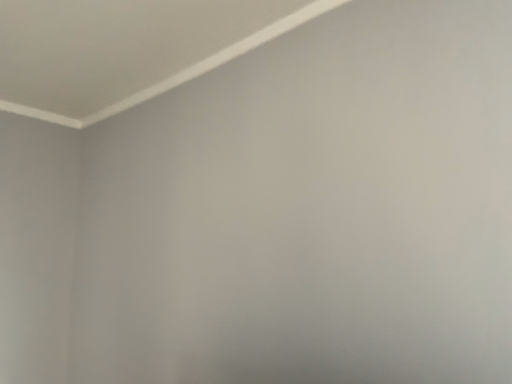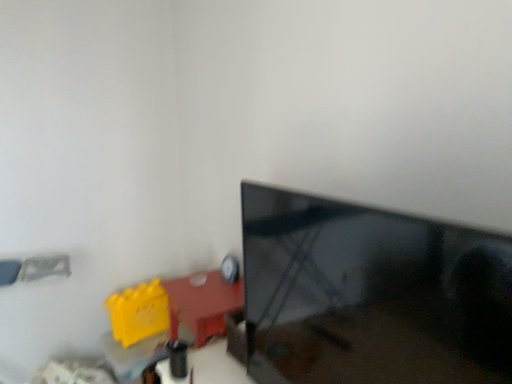
Question: Which way did the camera rotate in the video?

Choices:
 (A) rotated downward
 (B) rotated upward

Answer: (A)